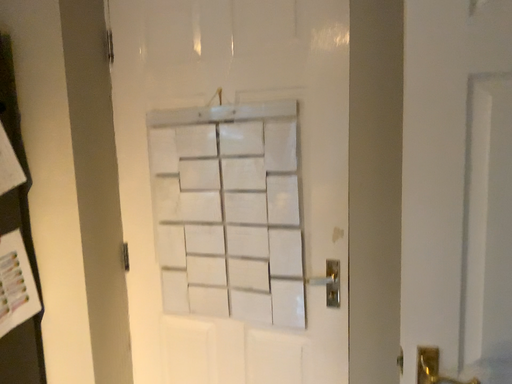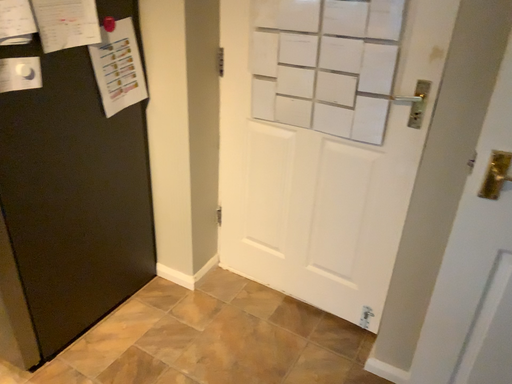
Question: Which way did the camera rotate in the video?

Choices:
 (A) rotated downward
 (B) rotated upward

Answer: (A)